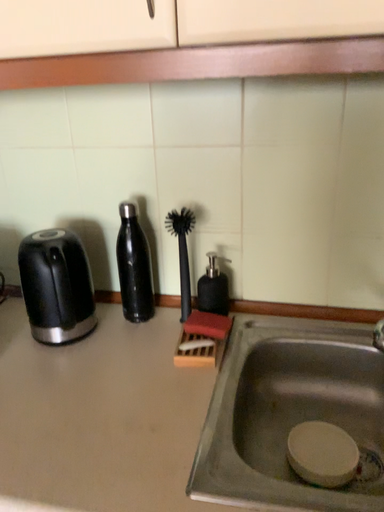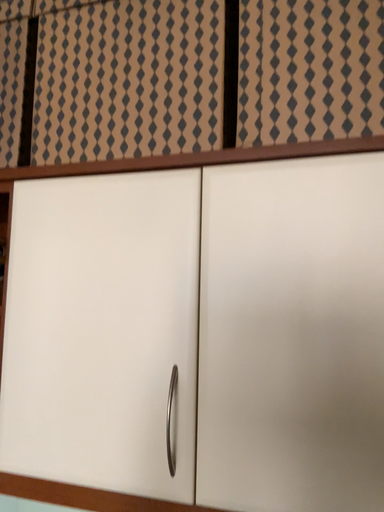
Question: How did the camera likely rotate when shooting the video?

Choices:
 (A) rotated downward
 (B) rotated upward

Answer: (B)